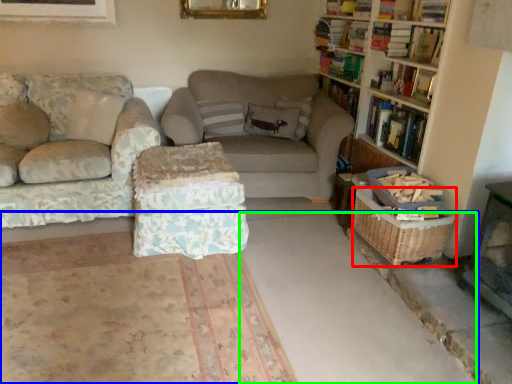
Question: Estimate the real-world distances between objects in this image. Which object is closer to basket (highlighted by a red box), concrete (highlighted by a blue box) or concrete (highlighted by a green box)?

Choices:
 (A) concrete
 (B) concrete

Answer: (A)